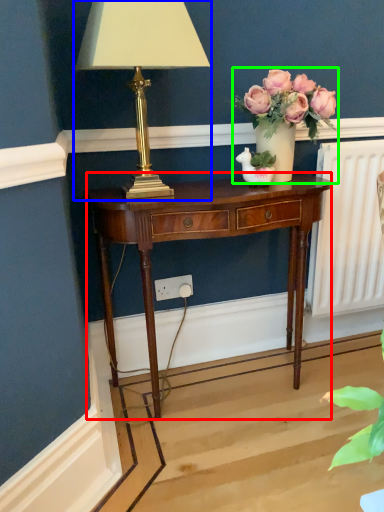
Question: Which is nearer to the nightstand (highlighted by a red box)? lamp (highlighted by a blue box) or houseplant (highlighted by a green box).

Choices:
 (A) lamp
 (B) houseplant

Answer: (B)